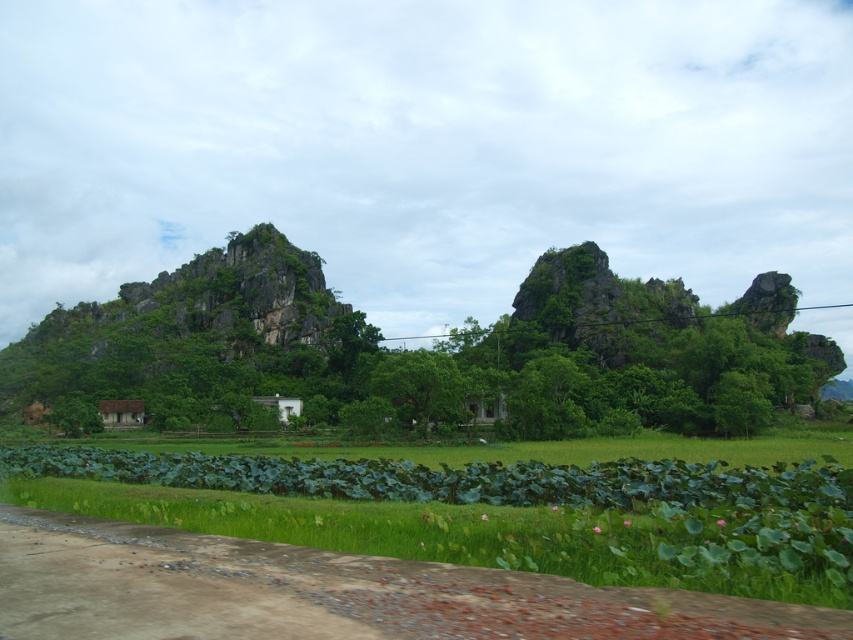
You are standing at the starting point of the paved road in the foreground and want to reach the rocky hills in the background. You see two points marked on your map as point 1 at coordinates point [827,554] and point 2 at coordinates point [196,388]. Which point should you head towards to get closer to the rocky hills?

Point 2 at coordinates point [196,388] is further back than point 1 at coordinates point [827,554], so you should head towards point 2 at coordinates point [196,388] to get closer to the rocky hills.

You are a hiker standing on the paved road in the foreground. You want to reach the rocky gray mountain at left but need to cross the green grassy field at lower center first. Which area will require more effort to traverse based on their sizes?

The rocky gray mountain at left is larger than the green grassy field at lower center, so traversing the rocky gray mountain at left will likely require more effort due to its greater size.

You are standing at point (488, 513) in the image. What do you see around you?

You are standing in the green grassy field at lower center.